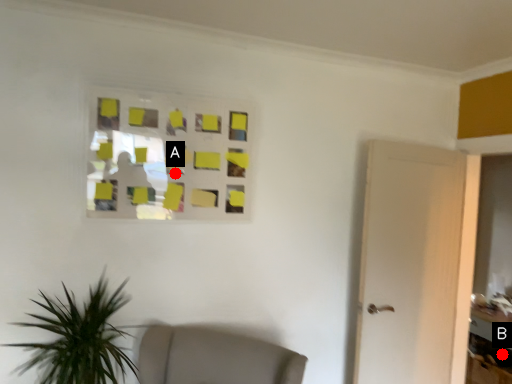
Question: Two points are circled on the image, labeled by A and B beside each circle. Which point is closer to the camera?

Choices:
 (A) A is closer
 (B) B is closer

Answer: (A)